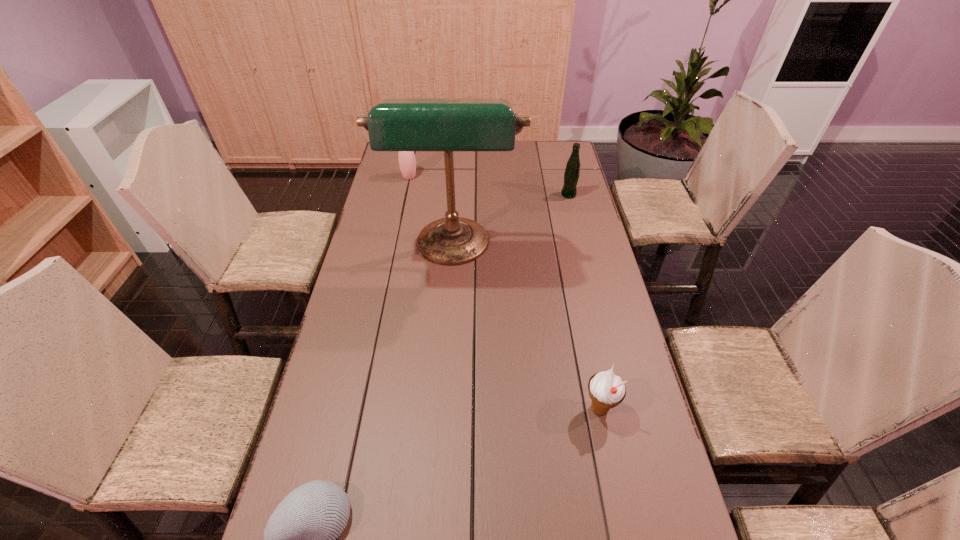
Find the location of `object that is the third closest to the second shortest object`. object that is the third closest to the second shortest object is located at coordinates click(572, 171).

The image size is (960, 540). What are the coordinates of `vacant point that satisfies the following two spatial constraints: 1. above the green lampshade of the fourth tallest object; 2. on the left side of the third nearest object` in the screenshot? It's located at (443, 409).